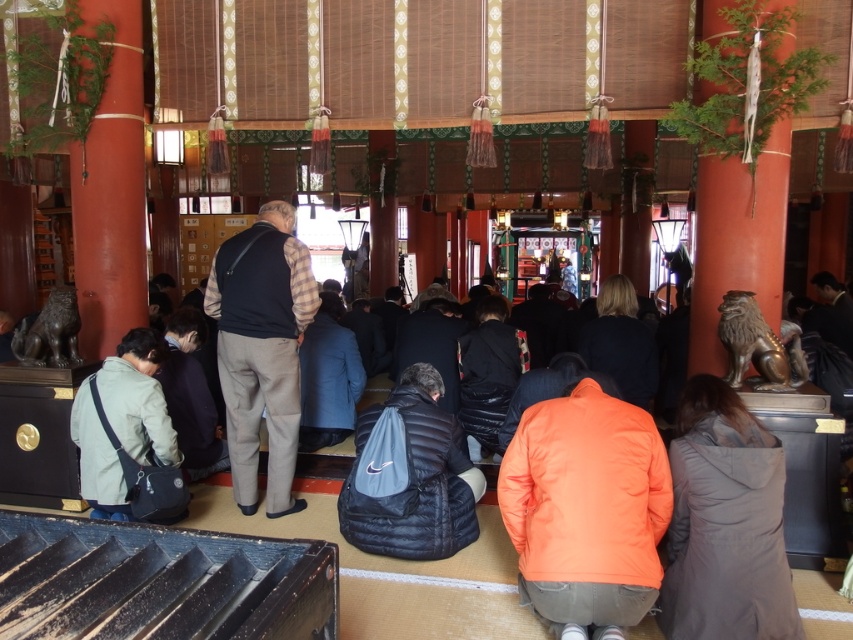
Question: Among these points, which one is farthest from the camera?

Choices:
 (A) (248, 321)
 (B) (469, 515)
 (C) (86, 492)

Answer: (A)

Question: Which object is closer to the camera taking this photo?

Choices:
 (A) light gray fabric jacket at lower left
 (B) dark blue jacket at center
 (C) gray matte jacket at lower right
 (D) black down jacket at center

Answer: (C)

Question: Can you confirm if light gray fabric bag at lower left is thinner than light gray fabric jacket at lower left?

Choices:
 (A) yes
 (B) no

Answer: (B)

Question: Can you confirm if light gray fabric bag at lower left is bigger than blue wool coat at center?

Choices:
 (A) yes
 (B) no

Answer: (B)

Question: Observing the image, what is the correct spatial positioning of orange matte jacket at center in reference to blue wool coat at center?

Choices:
 (A) below
 (B) above

Answer: (A)

Question: Estimate the real-world distances between objects in this image. Which object is farther from the light gray fabric jacket at lower left?

Choices:
 (A) gray matte jacket at lower right
 (B) dark blue jacket at center
 (C) black down jacket at center

Answer: (A)